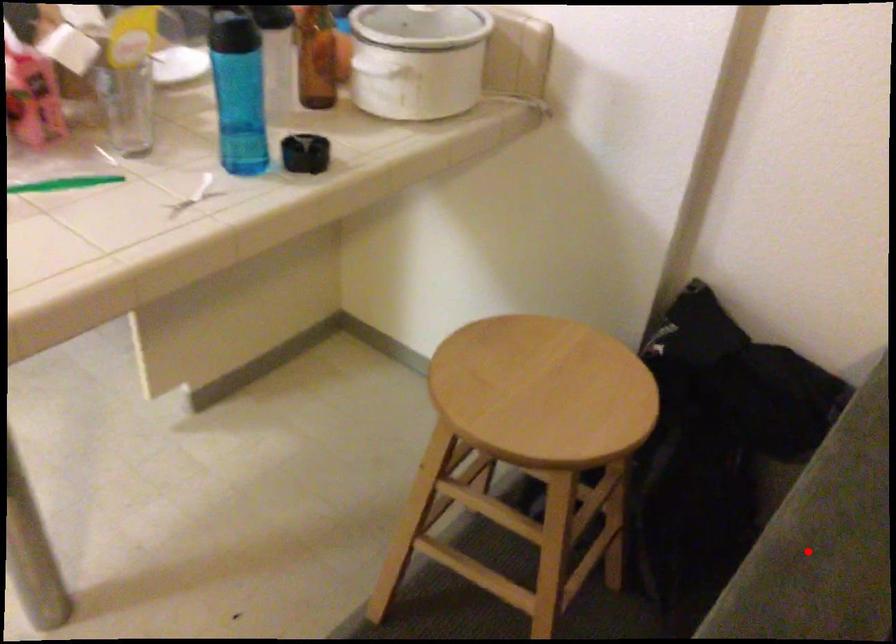
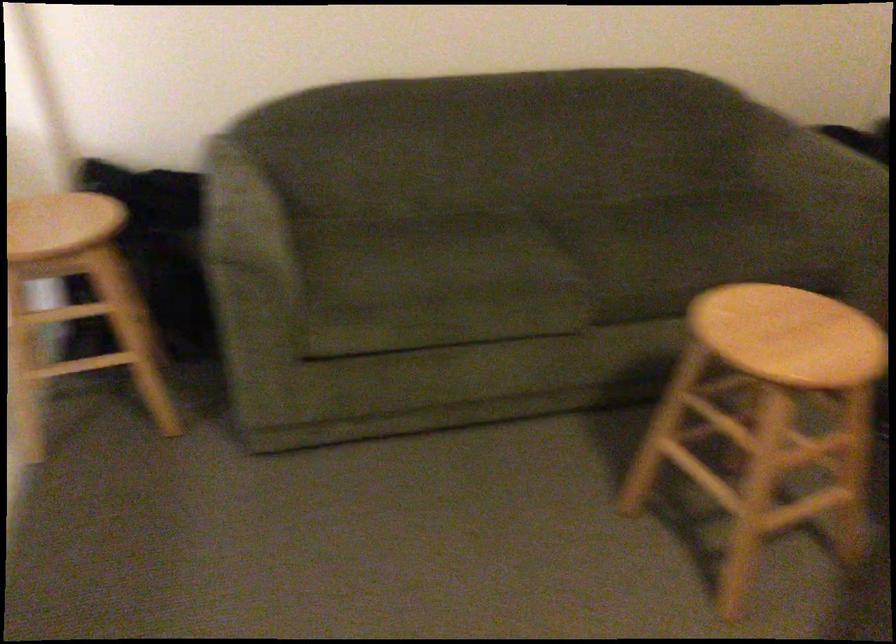
Question: I am providing you with two images of the same scene from different viewpoints. A red point is shown in image1. For the corresponding object point in image2, is it positioned nearer or farther from the camera?

Choices:
 (A) Nearer
 (B) Farther

Answer: (B)